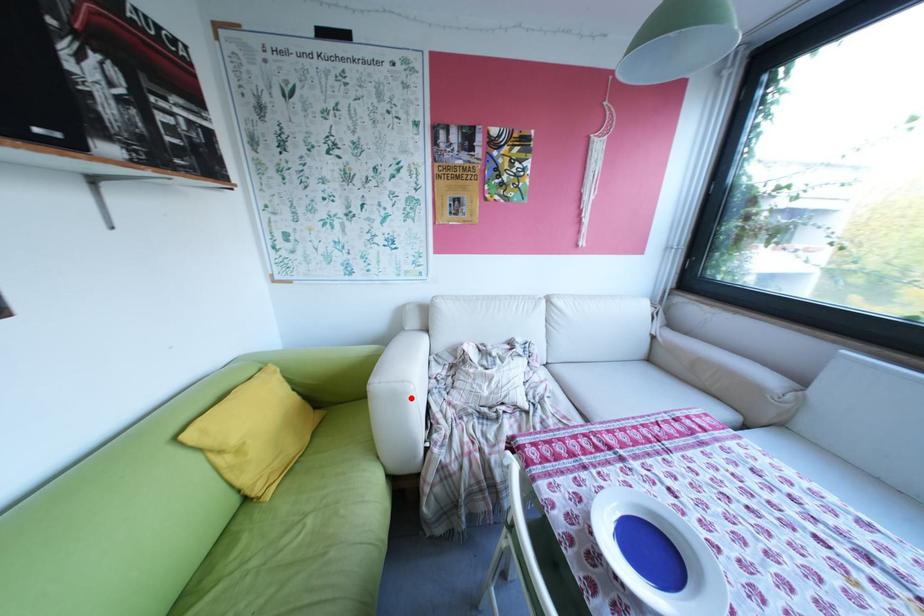
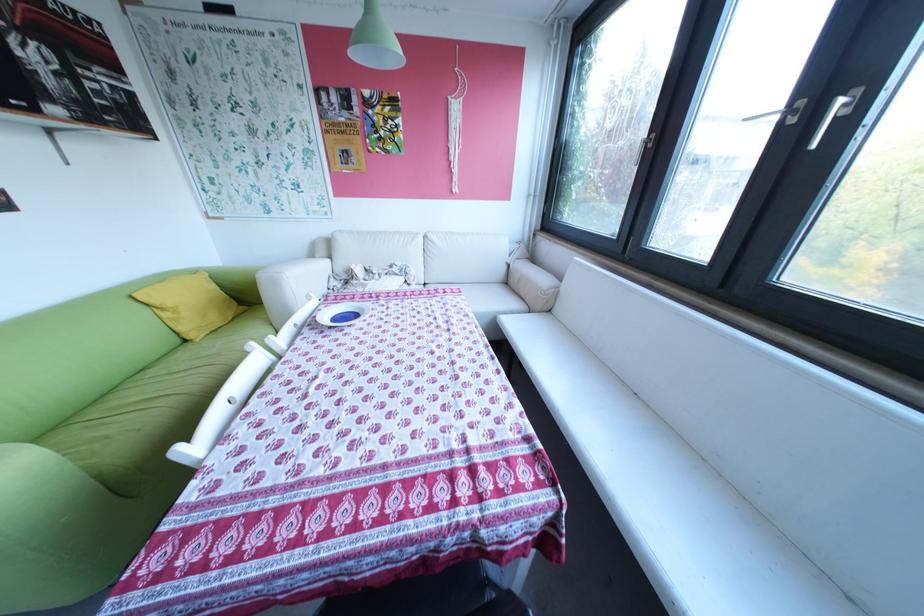
Question: I am providing you with two images of the same scene from different viewpoints. Given a red point in image1, look at the same physical point in image2. Is it:

Choices:
 (A) Closer to the viewpoint
 (B) Farther from the viewpoint

Answer: (A)